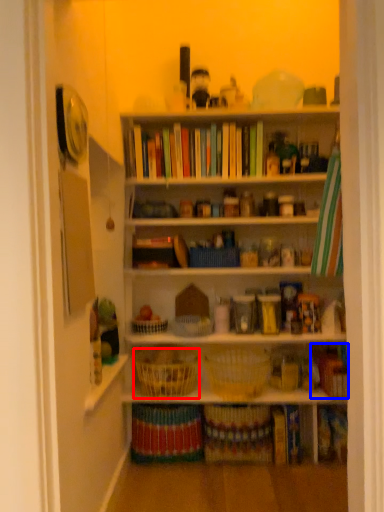
Question: Which point is closer to the camera, basket (highlighted by a red box) or book (highlighted by a blue box)?

Choices:
 (A) basket
 (B) book

Answer: (A)